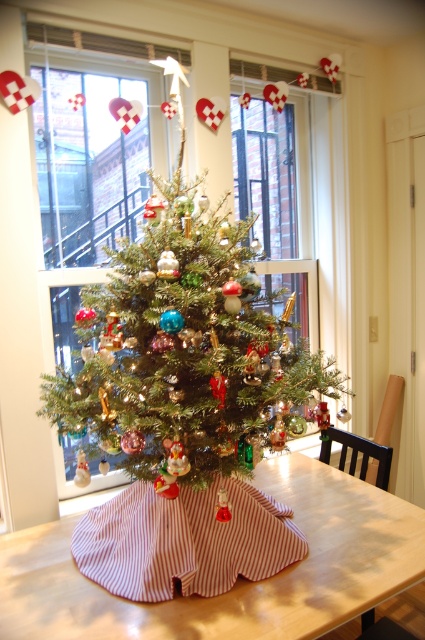
Is green matte christmas tree at center in front of wooden table at center?

No, it is not.

Is point (161, 476) behind point (359, 611)?

No, it is in front of (359, 611).

Who is more forward, [223,202] or [150,636]?

Point [150,636]

Where is `green matte christmas tree at center`? green matte christmas tree at center is located at coordinates (184, 353).